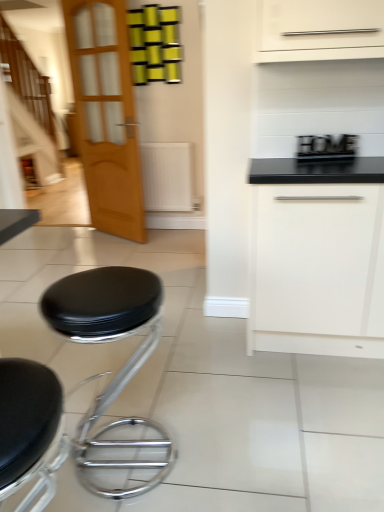
Question: Considering the positions of point [109, 183] and point [291, 306], is point [109, 183] closer or farther from the camera than point [291, 306]?

Choices:
 (A) closer
 (B) farther

Answer: (B)

Question: Looking at their shapes, would you say light brown wooden door at left is wider or thinner than white matte drawer at center right?

Choices:
 (A) thin
 (B) wide

Answer: (A)

Question: Estimate the real-world distances between objects in this image. Which object is farther from the light brown wooden door at left?

Choices:
 (A) black leather stool at lower left, the 1th stool viewed from the back
 (B) wooden staircase at left
 (C) wooden sign at upper right
 (D) white matte drawer at center right
 (E) black leather stool at lower left, the first stool when ordered from front to back

Answer: (E)

Question: Estimate the real-world distances between objects in this image. Which object is farther from the white matte drawer at center right?

Choices:
 (A) wooden sign at upper right
 (B) light brown wooden door at left
 (C) black leather stool at lower left, the second stool from the front
 (D) black leather stool at lower left, the first stool when ordered from front to back
 (E) wooden staircase at left

Answer: (E)